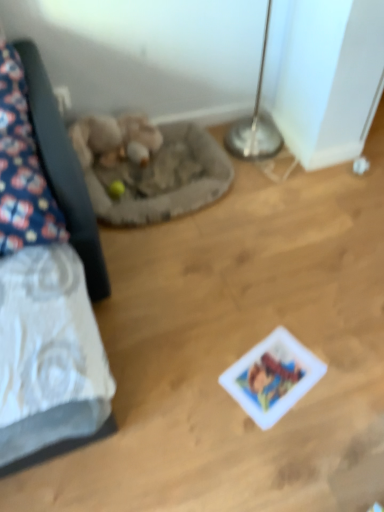
Find the location of `free space in front of white glossy card at center`. free space in front of white glossy card at center is located at coordinates (286, 446).